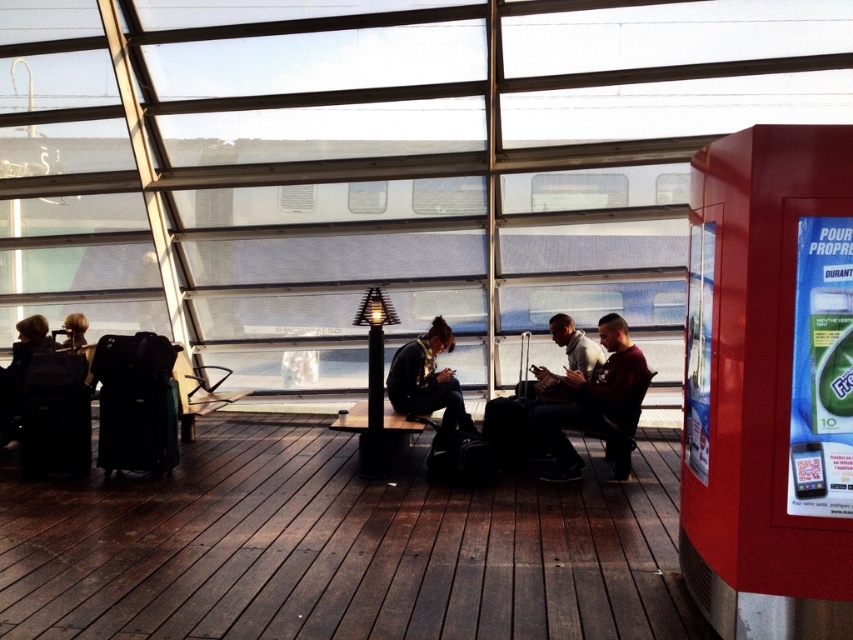
Is metallic red vending machine at right smaller than matte black suitcase at left?

No.

Does metallic red vending machine at right have a greater width compared to matte black suitcase at left?

No.

You are a GUI agent. You are given a task and a screenshot of the screen. Output one action in this format:
    pyautogui.click(x=<x>, y=<y>)
    Task: Click on the metallic red vending machine at right
    The width and height of the screenshot is (853, 640).
    Given the screenshot: What is the action you would take?
    pyautogui.click(x=769, y=385)

Identify the location of metallic red vending machine at right. The height and width of the screenshot is (640, 853). (769, 385).

Can you confirm if matte black suitcase at left is positioned to the left of matte black jacket at lower left?

Correct, you'll find matte black suitcase at left to the left of matte black jacket at lower left.

Is point (54, 344) positioned before point (67, 326)?

That is True.

From the picture: Who is more forward, (33,317) or (85,321)?

Positioned in front is point (33,317).

Where is `matte black suitcase at left`? matte black suitcase at left is located at coordinates [x=20, y=371].

Who is shorter, metallic gray chair at center or matte black jacket at lower left?

matte black jacket at lower left is shorter.

Does metallic gray chair at center have a larger size compared to matte black jacket at lower left?

Indeed, metallic gray chair at center has a larger size compared to matte black jacket at lower left.

The width and height of the screenshot is (853, 640). What are the coordinates of `metallic gray chair at center` in the screenshot? It's located at (196, 392).